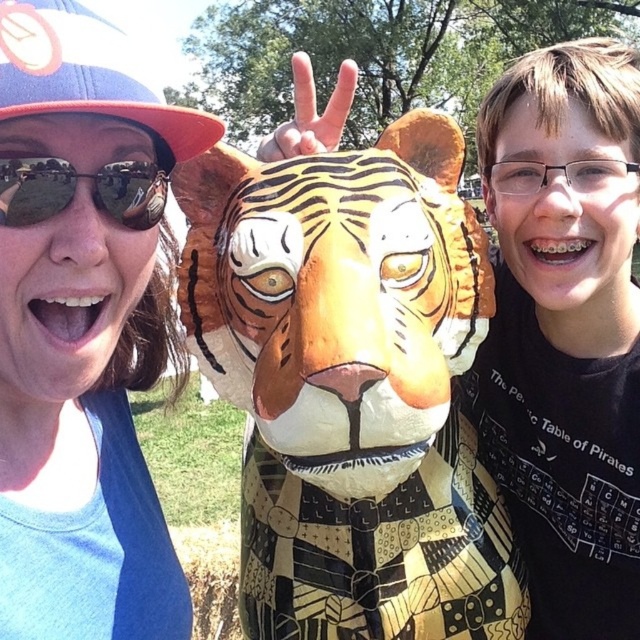
Is point (384, 268) positioned after point (113, 264)?

Yes, point (384, 268) is farther from viewer.

Find the location of `orange painted mask at center`. orange painted mask at center is located at coordinates (352, 385).

At what (x,y) coordinates should I click in order to perform the action: click on orange painted mask at center. Please return your answer as a coordinate pair (x, y). The height and width of the screenshot is (640, 640). Looking at the image, I should click on (352, 385).

Who is more distant from viewer, [8,19] or [65,176]?

The point [65,176] is more distant.

Can you confirm if matte blue baseball cap at left is smaller than matte black sunglasses at left?

Actually, matte blue baseball cap at left might be larger than matte black sunglasses at left.

Locate an element on the screen. The height and width of the screenshot is (640, 640). matte blue baseball cap at left is located at coordinates (88, 74).

Does orange painted mask at center appear over matte blue baseball cap at left?

Incorrect, orange painted mask at center is not positioned above matte blue baseball cap at left.

Is point (422, 636) farther from viewer compared to point (128, 88)?

Yes, it is behind point (128, 88).

This screenshot has height=640, width=640. I want to click on orange painted mask at center, so click(x=352, y=385).